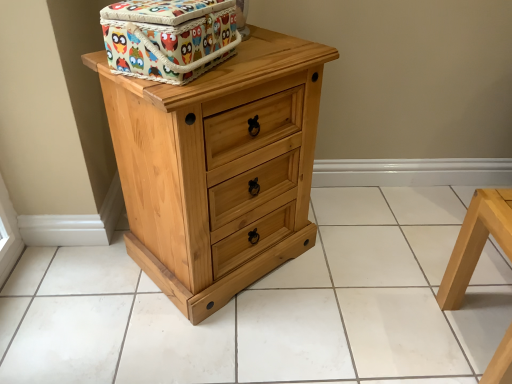
The width and height of the screenshot is (512, 384). In order to click on vacant position to the left of light wood stool at lower right in this screenshot , I will do `click(404, 331)`.